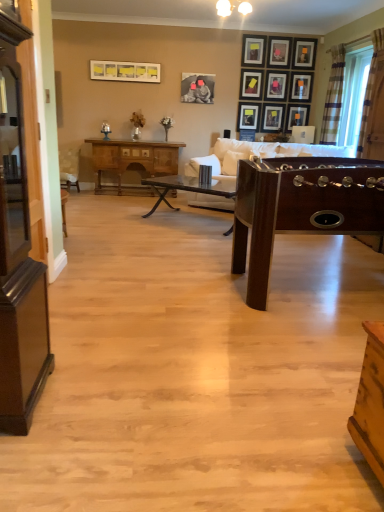
Find the location of `white fabric couch at center`. white fabric couch at center is located at coordinates (259, 154).

From the picture: What is the approximate height of white fabric couch at center?

It is 35.45 inches.

Image resolution: width=384 pixels, height=512 pixels. What do you see at coordinates (248, 116) in the screenshot? I see `matte black picture frame at upper center, the 9th picture frame when ordered from right to left` at bounding box center [248, 116].

From the picture: How much space does matte black picture frame at upper center, the 3th picture frame from the left, occupy horizontally?

The width of matte black picture frame at upper center, the 3th picture frame from the left, is 1.56 inches.

Describe the element at coordinates (370, 87) in the screenshot. This screenshot has height=512, width=384. I see `plaid fabric curtain at upper right, which is counted as the first curtain, starting from the front` at that location.

This screenshot has width=384, height=512. What do you see at coordinates (297, 116) in the screenshot? I see `matte black picture frame at upper right, the 3th picture frame when ordered from right to left` at bounding box center [297, 116].

Measure the distance between plaid fabric curtain at upper right, the 1th curtain from the back, and camera.

The distance of plaid fabric curtain at upper right, the 1th curtain from the back, from camera is 6.13 meters.

Image resolution: width=384 pixels, height=512 pixels. What are the coordinates of `matte black picture frame at upper center, the sixth picture frame when ordered from left to right` in the screenshot? It's located at (273, 118).

Which of these two, plaid fabric curtain at upper right, which appears as the second curtain when viewed from the front, or mahogany wood foosball table at right, which is the 3th table in back-to-front order, is bigger?

With larger size is mahogany wood foosball table at right, which is the 3th table in back-to-front order.

Based on the photo, between plaid fabric curtain at upper right, the 1th curtain from the back, and mahogany wood foosball table at right, positioned as the 1th table in front-to-back order, which one is positioned in front?

mahogany wood foosball table at right, positioned as the 1th table in front-to-back order.

What's the angular difference between plaid fabric curtain at upper right, the 1th curtain from the back, and mahogany wood foosball table at right, positioned as the 1th table in front-to-back order,'s facing directions?

There is a 89.2-degree angle between the facing directions of plaid fabric curtain at upper right, the 1th curtain from the back, and mahogany wood foosball table at right, positioned as the 1th table in front-to-back order.

Which is more distant, [337,123] or [266,280]?

Positioned behind is point [337,123].

Considering the relative sizes of matte black picture frame at upper center, placed as the eighth picture frame when sorted from right to left, and brown wooden table at center, which appears as the first table when viewed from the back, in the image provided, is matte black picture frame at upper center, placed as the eighth picture frame when sorted from right to left, thinner than brown wooden table at center, which appears as the first table when viewed from the back,?

Yes, matte black picture frame at upper center, placed as the eighth picture frame when sorted from right to left, is thinner than brown wooden table at center, which appears as the first table when viewed from the back.

From the image's perspective, would you say matte black picture frame at upper center, positioned as the fourth picture frame in left-to-right order, is shown under brown wooden table at center, which appears as the first table when viewed from the back?

Actually, matte black picture frame at upper center, positioned as the fourth picture frame in left-to-right order, appears above brown wooden table at center, which appears as the first table when viewed from the back, in the image.

Considering the points (248, 78) and (107, 152), which point is in front, point (248, 78) or point (107, 152)?

Positioned in front is point (107, 152).

Looking at the image, does matte black picture frame at upper center, positioned as the fourth picture frame in left-to-right order, seem bigger or smaller compared to brown wooden table at center, which appears as the first table when viewed from the back?

matte black picture frame at upper center, positioned as the fourth picture frame in left-to-right order, is smaller than brown wooden table at center, which appears as the first table when viewed from the back.

Between wooden picture frame at upper center, the eighth picture frame when ordered from left to right, and matte black picture frame at upper right, marked as the 11th picture frame in a left-to-right arrangement, which one has larger size?

matte black picture frame at upper right, marked as the 11th picture frame in a left-to-right arrangement, is bigger.

Can you see wooden picture frame at upper center, arranged as the 4th picture frame when viewed from the right, touching matte black picture frame at upper right, marked as the 11th picture frame in a left-to-right arrangement?

No, wooden picture frame at upper center, arranged as the 4th picture frame when viewed from the right, is not in contact with matte black picture frame at upper right, marked as the 11th picture frame in a left-to-right arrangement.

Is wooden picture frame at upper center, arranged as the 4th picture frame when viewed from the right, shorter than matte black picture frame at upper right, the first picture frame from the right?

Yes.

How much distance is there between matte black picture frame at upper center, placed as the eighth picture frame when sorted from right to left, and matte yellow picture frame at upper center, positioned as the 1th picture frame in left-to-right order?

5.56 feet.

Is matte black picture frame at upper center, positioned as the fourth picture frame in left-to-right order, situated inside matte yellow picture frame at upper center, positioned as the 1th picture frame in left-to-right order, or outside?

matte black picture frame at upper center, positioned as the fourth picture frame in left-to-right order, is not inside matte yellow picture frame at upper center, positioned as the 1th picture frame in left-to-right order, it's outside.

Is matte black picture frame at upper center, placed as the eighth picture frame when sorted from right to left, next to matte yellow picture frame at upper center, which appears as the eleventh picture frame when viewed from the right, and touching it?

There is a gap between matte black picture frame at upper center, placed as the eighth picture frame when sorted from right to left, and matte yellow picture frame at upper center, which appears as the eleventh picture frame when viewed from the right.

Does matte black picture frame at upper center, placed as the eighth picture frame when sorted from right to left, appear on the left side of matte yellow picture frame at upper center, which appears as the eleventh picture frame when viewed from the right?

No.

From a real-world perspective, is matte black picture frame at upper center, which is the 5th picture frame from right to left, positioned above or below matte black picture frame at upper center, which is the 5th picture frame from left to right?

From a real-world perspective, matte black picture frame at upper center, which is the 5th picture frame from right to left, is physically below matte black picture frame at upper center, which is the 5th picture frame from left to right.

Considering the sizes of objects matte black picture frame at upper center, which is the 5th picture frame from right to left, and matte black picture frame at upper center, which is the 5th picture frame from left to right, in the image provided, who is shorter, matte black picture frame at upper center, which is the 5th picture frame from right to left, or matte black picture frame at upper center, which is the 5th picture frame from left to right,?

Standing shorter between the two is matte black picture frame at upper center, which is the 5th picture frame from right to left.

Is matte black picture frame at upper center, which is the 5th picture frame from right to left, turned away from matte black picture frame at upper center, which is the 5th picture frame from left to right?

No, matte black picture frame at upper center, which is the 5th picture frame from left to right, is not at the back of matte black picture frame at upper center, which is the 5th picture frame from right to left.

Which is more to the right, wooden picture frame at upper center, arranged as the 4th picture frame when viewed from the right, or wooden picture frame at upper center, marked as the 10th picture frame in a left-to-right arrangement?

Positioned to the right is wooden picture frame at upper center, marked as the 10th picture frame in a left-to-right arrangement.

Does wooden picture frame at upper center, the eighth picture frame when ordered from left to right, turn towards wooden picture frame at upper center, marked as the 10th picture frame in a left-to-right arrangement?

No, wooden picture frame at upper center, the eighth picture frame when ordered from left to right, is not aimed at wooden picture frame at upper center, marked as the 10th picture frame in a left-to-right arrangement.

Which point is more distant from viewer, (x=284, y=47) or (x=304, y=78)?

The point (x=304, y=78) is farther.

From a real-world perspective, relative to wooden picture frame at upper center, positioned as the 2th picture frame in right-to-left order, is wooden picture frame at upper center, arranged as the 4th picture frame when viewed from the right, vertically above or below?

wooden picture frame at upper center, arranged as the 4th picture frame when viewed from the right, is situated higher than wooden picture frame at upper center, positioned as the 2th picture frame in right-to-left order, in the real world.

Is point (292, 156) in front of point (193, 93)?

Yes, it is.

From a real-world perspective, is white fabric couch at center under matte black picture frame at center, which is counted as the tenth picture frame, starting from the right?

Indeed, from a real-world perspective, white fabric couch at center is positioned beneath matte black picture frame at center, which is counted as the tenth picture frame, starting from the right.

From the image's perspective, is white fabric couch at center over matte black picture frame at center, which is counted as the tenth picture frame, starting from the right?

No.

Is white fabric couch at center in contact with matte black picture frame at center, which is counted as the tenth picture frame, starting from the right?

No, white fabric couch at center is not beside matte black picture frame at center, which is counted as the tenth picture frame, starting from the right.

Where is `the 2nd curtain above when counting from the mahogany wood foosball table at right, which is the 3th table in back-to-front order (from the image's perspective)`? The height and width of the screenshot is (512, 384). the 2nd curtain above when counting from the mahogany wood foosball table at right, which is the 3th table in back-to-front order (from the image's perspective) is located at coordinates (333, 97).

Where is `picture frame that is the 6th object located behind the brown wooden table at center, the third table in the front-to-back sequence`? Image resolution: width=384 pixels, height=512 pixels. picture frame that is the 6th object located behind the brown wooden table at center, the third table in the front-to-back sequence is located at coordinates (251, 84).

In the scene shown: Based on their spatial positions, is matte black picture frame at upper center, positioned as the 7th picture frame in left-to-right order, or white fabric couch at center further from brown wooden table at center, which appears as the first table when viewed from the back?

matte black picture frame at upper center, positioned as the 7th picture frame in left-to-right order, is positioned further to the anchor brown wooden table at center, which appears as the first table when viewed from the back.

Considering their positions, is matte black picture frame at upper center, the 3th picture frame from the left, positioned closer to metallic glass coffee table at center, which is counted as the second table, starting from the front, than matte black picture frame at center, the 2th picture frame from the left?

Based on the image, matte black picture frame at center, the 2th picture frame from the left, appears to be nearer to metallic glass coffee table at center, which is counted as the second table, starting from the front.

From the image, which object appears to be nearer to mahogany wood foosball table at right, positioned as the 1th table in front-to-back order, matte black picture frame at upper center, which is the 5th picture frame from left to right, or matte black picture frame at upper center, the 3th picture frame from the left?

Among the two, matte black picture frame at upper center, the 3th picture frame from the left, is located nearer to mahogany wood foosball table at right, positioned as the 1th table in front-to-back order.

From the image, which object appears to be nearer to wooden picture frame at upper center, marked as the 10th picture frame in a left-to-right arrangement, metallic glass coffee table at center, the second table in the back-to-front sequence, or brown wooden table at center, which appears as the first table when viewed from the back?

The object closer to wooden picture frame at upper center, marked as the 10th picture frame in a left-to-right arrangement, is brown wooden table at center, which appears as the first table when viewed from the back.

When comparing their distances from matte black picture frame at upper center, which is the 5th picture frame from left to right, does mahogany wood foosball table at right, positioned as the 1th table in front-to-back order, or matte black picture frame at upper right, the 3th picture frame when ordered from right to left, seem further?

Based on the image, mahogany wood foosball table at right, positioned as the 1th table in front-to-back order, appears to be further to matte black picture frame at upper center, which is the 5th picture frame from left to right.

Which object lies further to the anchor point brown wooden table at center, which appears as the first table when viewed from the back, white fabric couch at center or matte black picture frame at upper center, which is the 5th picture frame from right to left?

The object further to brown wooden table at center, which appears as the first table when viewed from the back, is matte black picture frame at upper center, which is the 5th picture frame from right to left.

Looking at the image, which one is located closer to matte black picture frame at upper center, which is counted as the sixth picture frame, starting from the right, matte black picture frame at upper center, positioned as the fourth picture frame in left-to-right order, or matte black picture frame at upper center, which is the 5th picture frame from left to right?

Based on the image, matte black picture frame at upper center, positioned as the fourth picture frame in left-to-right order, appears to be nearer to matte black picture frame at upper center, which is counted as the sixth picture frame, starting from the right.

Which object lies further to the anchor point wooden picture frame at upper center, arranged as the 4th picture frame when viewed from the right, matte black picture frame at center, the 2th picture frame from the left, or white fabric couch at center?

Based on the image, white fabric couch at center appears to be further to wooden picture frame at upper center, arranged as the 4th picture frame when viewed from the right.

The width and height of the screenshot is (384, 512). I want to click on studio couch between plaid fabric curtain at upper right, which is counted as the first curtain, starting from the front, and matte black picture frame at upper center, which is the 5th picture frame from left to right, from front to back, so click(259, 154).

Locate an element on the screen. table between metallic glass coffee table at center, which is counted as the second table, starting from the front, and matte black picture frame at center, the 2th picture frame from the left, in the front-back direction is located at coordinates (133, 159).

You are a GUI agent. You are given a task and a screenshot of the screen. Output one action in this format:
    pyautogui.click(x=<x>, y=<y>)
    Task: Click on the studio couch between shiny dark wood cabinet at left and matte black picture frame at upper center, which is the seventh picture frame in right-to-left order, from front to back
    
    Given the screenshot: What is the action you would take?
    pyautogui.click(x=259, y=154)

The width and height of the screenshot is (384, 512). I want to click on picture frame between mahogany wood foosball table at right, positioned as the 1th table in front-to-back order, and matte black picture frame at upper center, which is the seventh picture frame in right-to-left order, along the z-axis, so click(x=124, y=71).